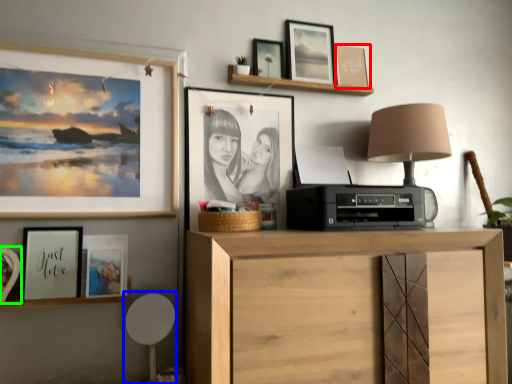
Question: Which object is the farthest from picture frame (highlighted by a red box)? Choose among these: swivel chair (highlighted by a blue box) or picture frame (highlighted by a green box).

Choices:
 (A) swivel chair
 (B) picture frame

Answer: (B)